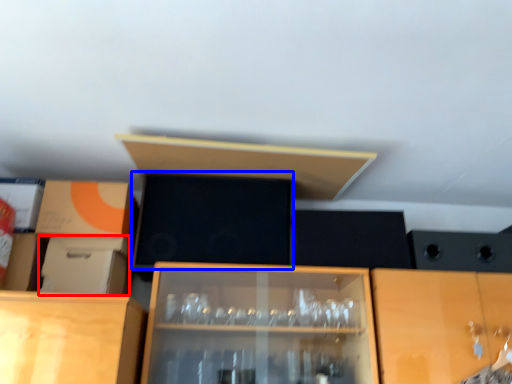
Question: Which of the following is the farthest to the observer, cardboard box (highlighted by a red box) or box (highlighted by a blue box)?

Choices:
 (A) cardboard box
 (B) box

Answer: (B)